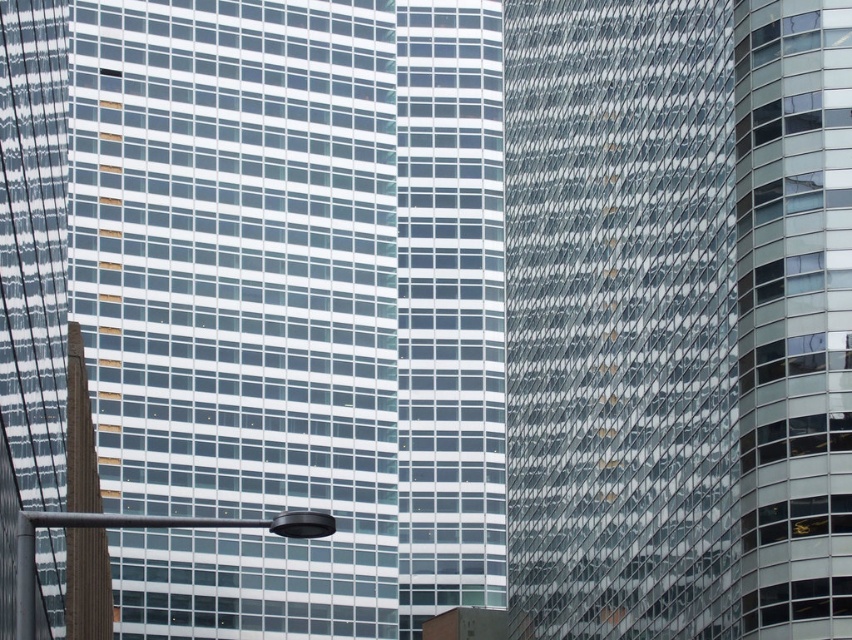
Which is more to the right, transparent glass building at center or glassy reflective skyscraper at center?

glassy reflective skyscraper at center is more to the right.

Is transparent glass building at center above glassy reflective skyscraper at center?

No.

This screenshot has width=852, height=640. What are the coordinates of `transparent glass building at center` in the screenshot? It's located at (286, 304).